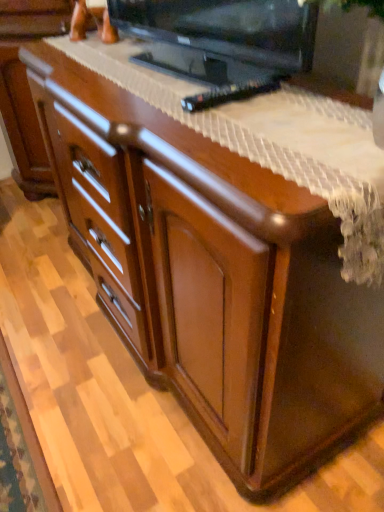
The image size is (384, 512). Find the location of `vacant area situated to the left side of black plastic remote at center`. vacant area situated to the left side of black plastic remote at center is located at coordinates (151, 98).